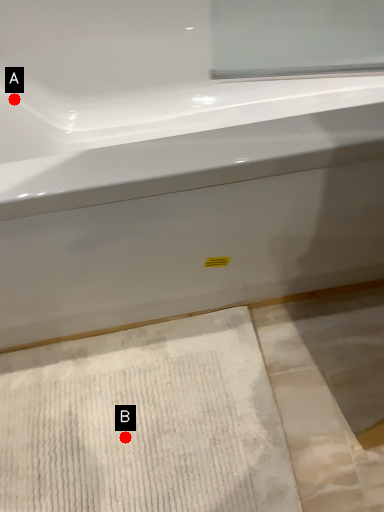
Question: Two points are circled on the image, labeled by A and B beside each circle. Which point is closer to the camera taking this photo?

Choices:
 (A) A is closer
 (B) B is closer

Answer: (B)